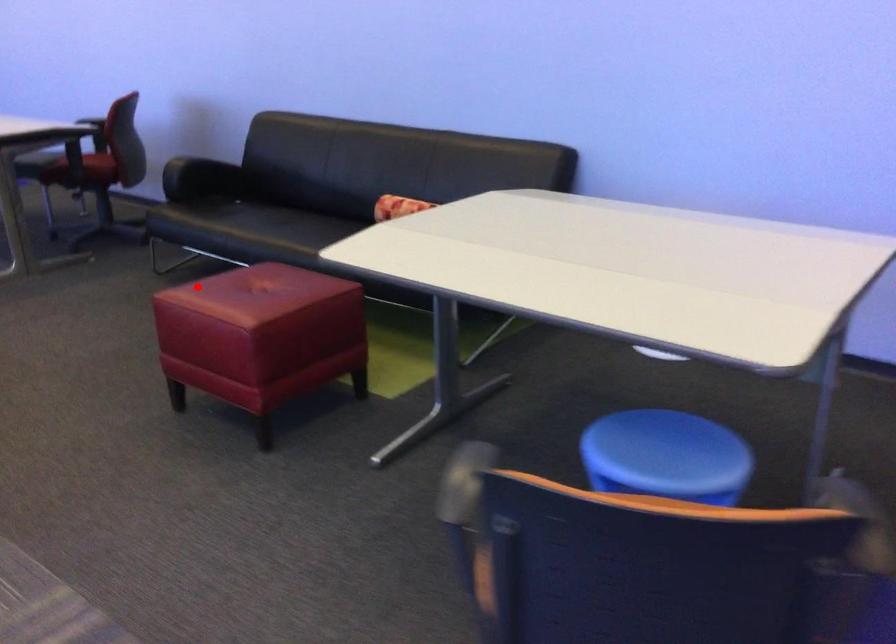
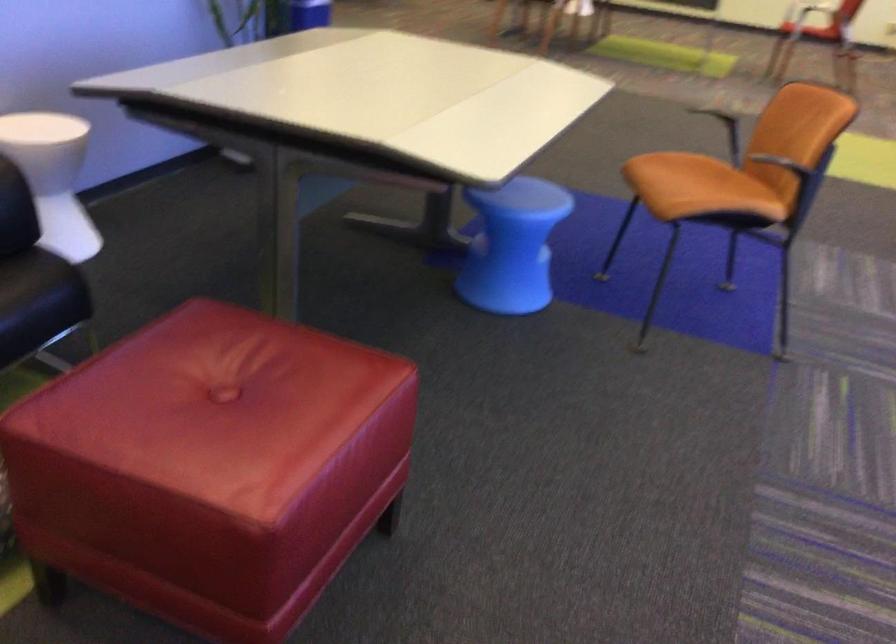
In the second image, find the point that corresponds to the highlighted location in the first image.

(211, 466)